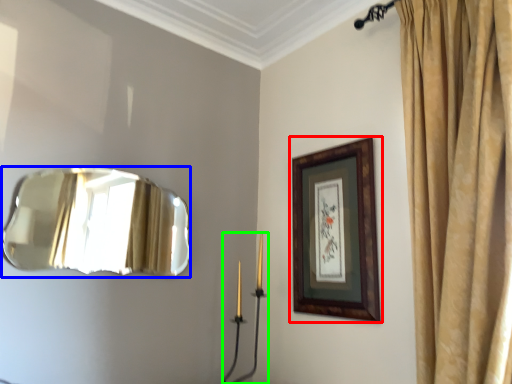
Question: Which object is positioned closest to picture frame (highlighted by a red box)? Select from mirror (highlighted by a blue box) and candle holder (highlighted by a green box).

Choices:
 (A) mirror
 (B) candle holder

Answer: (B)